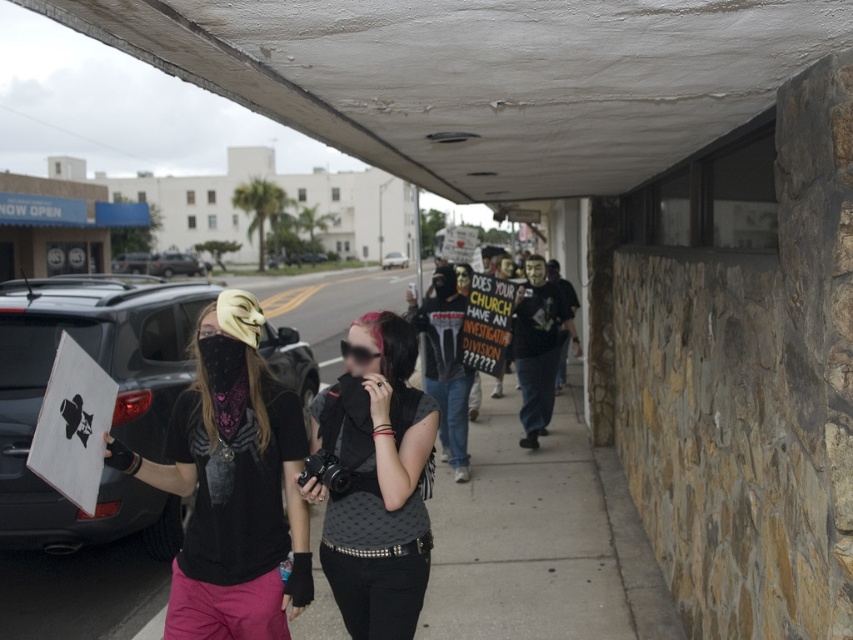
Question: Is the position of white textured ceiling at upper center more distant than that of silver metallic sedan at center?

Choices:
 (A) yes
 (B) no

Answer: (B)

Question: Is white textured ceiling at upper center in front of matte black camera at center?

Choices:
 (A) yes
 (B) no

Answer: (A)

Question: Does white textured ceiling at upper center have a smaller size compared to black matte car at left?

Choices:
 (A) yes
 (B) no

Answer: (A)

Question: Which point is farther to the camera?

Choices:
 (A) white textured ceiling at upper center
 (B) black matte car at left
 (C) concrete sidewalk at center
 (D) silver metallic sedan at center

Answer: (D)

Question: Which of these objects is positioned farthest from the matte black camera at center?

Choices:
 (A) concrete sidewalk at center
 (B) white textured ceiling at upper center

Answer: (A)

Question: Which of the following is the closest to the observer?

Choices:
 (A) white textured ceiling at upper center
 (B) black matte car at left
 (C) silver metallic sedan at center
 (D) matte black camera at center

Answer: (A)